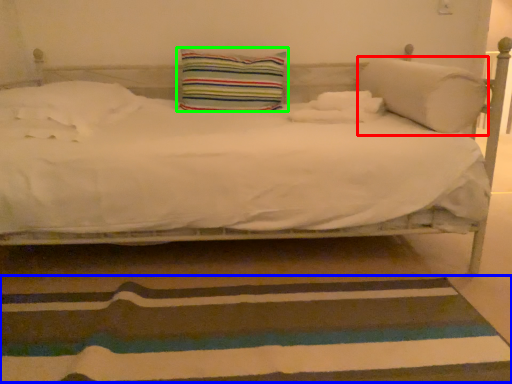
Question: Which object is positioned closest to pillow (highlighted by a red box)? Select from doormat (highlighted by a blue box) and pillow (highlighted by a green box).

Choices:
 (A) doormat
 (B) pillow

Answer: (B)